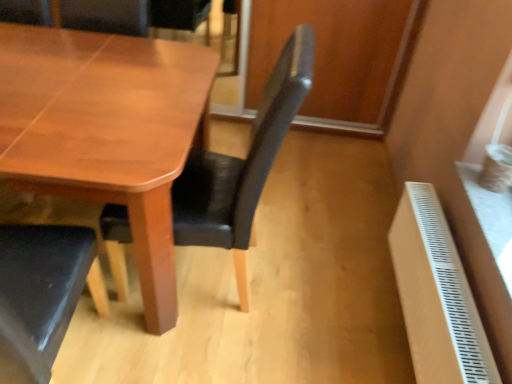
I want to click on free point behind white plastic radiator at lower right, so click(343, 250).